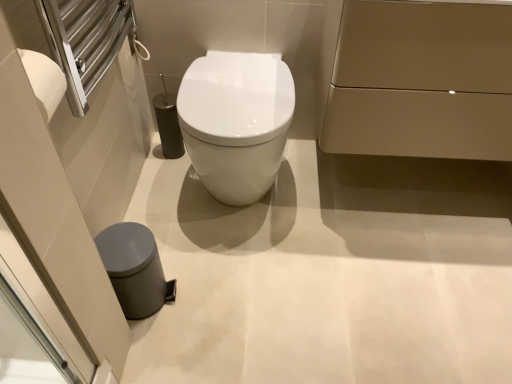
Question: Is matte gold cabinet at upper right, acting as the second porcelain starting from the bottom, smaller than white glossy toilet at center?

Choices:
 (A) no
 (B) yes

Answer: (A)

Question: From a real-world perspective, is matte gold cabinet at upper right, acting as the second porcelain starting from the bottom, physically above white glossy toilet at center?

Choices:
 (A) yes
 (B) no

Answer: (A)

Question: Is there a large distance between matte gold cabinet at upper right, the 2th porcelain from the left, and white glossy toilet at center?

Choices:
 (A) no
 (B) yes

Answer: (A)

Question: Is matte gold cabinet at upper right, acting as the second porcelain starting from the bottom, located outside white glossy toilet at center?

Choices:
 (A) yes
 (B) no

Answer: (A)

Question: Does matte gold cabinet at upper right, positioned as the 1th porcelain in right-to-left order, appear on the right side of white glossy toilet at center?

Choices:
 (A) yes
 (B) no

Answer: (A)

Question: Are matte gold cabinet at upper right, acting as the second porcelain starting from the bottom, and white glossy toilet at center making contact?

Choices:
 (A) no
 (B) yes

Answer: (A)

Question: Does white glossy toilet at center appear on the left side of gray matte trash can at lower left, the 1th porcelain viewed from the left?

Choices:
 (A) yes
 (B) no

Answer: (B)

Question: Is white glossy toilet at center taller than gray matte trash can at lower left, which is the 1th porcelain from bottom to top?

Choices:
 (A) no
 (B) yes

Answer: (B)

Question: Is white glossy toilet at center wider than gray matte trash can at lower left, which is the 1th porcelain from bottom to top?

Choices:
 (A) yes
 (B) no

Answer: (A)

Question: Is white glossy toilet at center not within gray matte trash can at lower left, which is the 1th porcelain from bottom to top?

Choices:
 (A) no
 (B) yes

Answer: (B)

Question: Is white glossy toilet at center in front of gray matte trash can at lower left, the 1th porcelain viewed from the left?

Choices:
 (A) no
 (B) yes

Answer: (A)

Question: From a real-world perspective, does white glossy toilet at center sit lower than gray matte trash can at lower left, the second porcelain when ordered from right to left?

Choices:
 (A) no
 (B) yes

Answer: (A)

Question: From a real-world perspective, is white glossy toilet at center positioned over matte gold cabinet at upper right, the 2th porcelain from the left, based on gravity?

Choices:
 (A) no
 (B) yes

Answer: (A)